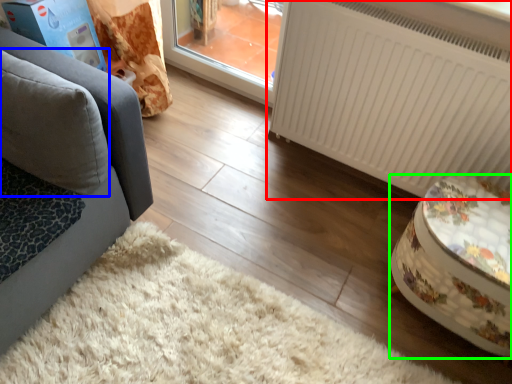
Question: Based on their relative distances, which object is nearer to radiator (highlighted by a red box)? Choose from pillow (highlighted by a blue box) and furniture (highlighted by a green box).

Choices:
 (A) pillow
 (B) furniture

Answer: (B)